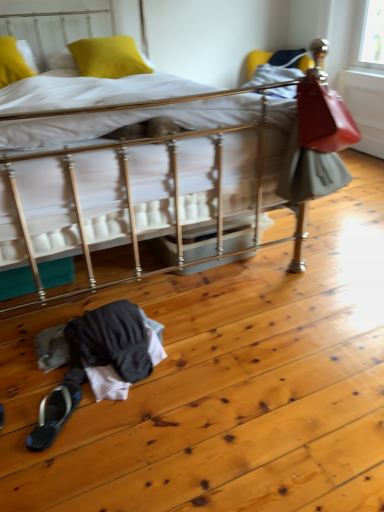
Question: Does metallic silver bed at center have a lesser height compared to black fabric slipper at lower left?

Choices:
 (A) yes
 (B) no

Answer: (B)

Question: From a real-world perspective, does metallic silver bed at center sit lower than black fabric slipper at lower left?

Choices:
 (A) yes
 (B) no

Answer: (B)

Question: Does metallic silver bed at center have a larger size compared to black fabric slipper at lower left?

Choices:
 (A) no
 (B) yes

Answer: (B)

Question: From the image's perspective, is metallic silver bed at center located beneath black fabric slipper at lower left?

Choices:
 (A) yes
 (B) no

Answer: (B)

Question: Does metallic silver bed at center appear on the right side of black fabric slipper at lower left?

Choices:
 (A) yes
 (B) no

Answer: (B)

Question: Is metallic silver bed at center closer to the viewer compared to black fabric slipper at lower left?

Choices:
 (A) no
 (B) yes

Answer: (B)

Question: Considering the relative positions of yellow fabric pillow at upper left, the first pillow when ordered from left to right, and black fabric slipper at lower left in the image provided, is yellow fabric pillow at upper left, the first pillow when ordered from left to right, to the right of black fabric slipper at lower left from the viewer's perspective?

Choices:
 (A) no
 (B) yes

Answer: (A)

Question: Is yellow fabric pillow at upper left, which ranks as the second pillow in right-to-left order, aimed at black fabric slipper at lower left?

Choices:
 (A) yes
 (B) no

Answer: (A)

Question: Can you confirm if yellow fabric pillow at upper left, which ranks as the second pillow in right-to-left order, is positioned to the left of black fabric slipper at lower left?

Choices:
 (A) no
 (B) yes

Answer: (B)

Question: Is yellow fabric pillow at upper left, which ranks as the second pillow in right-to-left order, turned away from black fabric slipper at lower left?

Choices:
 (A) yes
 (B) no

Answer: (B)

Question: Can we say yellow fabric pillow at upper left, which ranks as the second pillow in right-to-left order, lies outside black fabric slipper at lower left?

Choices:
 (A) no
 (B) yes

Answer: (B)

Question: Can you confirm if yellow fabric pillow at upper left, which ranks as the second pillow in right-to-left order, is bigger than black fabric slipper at lower left?

Choices:
 (A) no
 (B) yes

Answer: (B)

Question: From a real-world perspective, is black fabric slipper at lower left over yellow matte pillow at upper left, the second pillow positioned from the left?

Choices:
 (A) no
 (B) yes

Answer: (A)